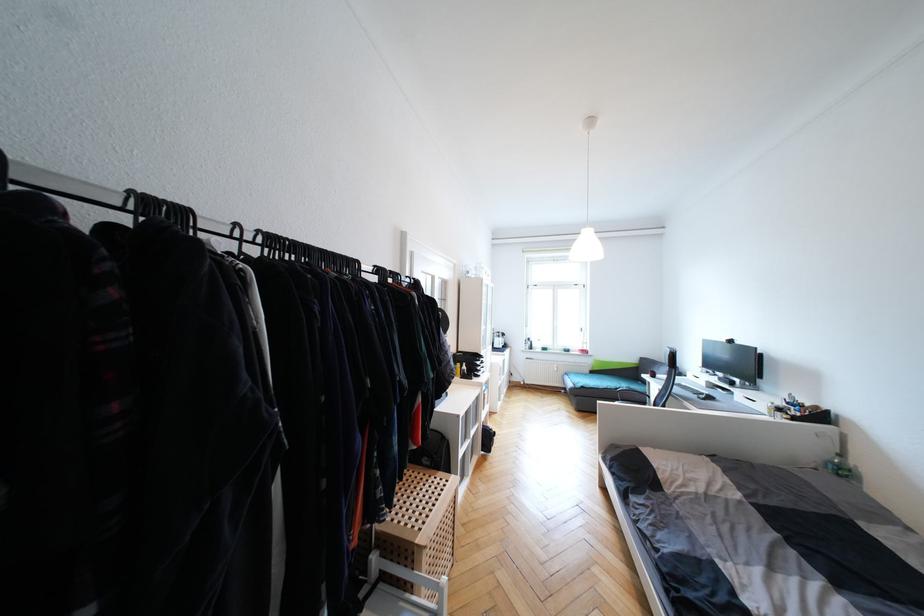
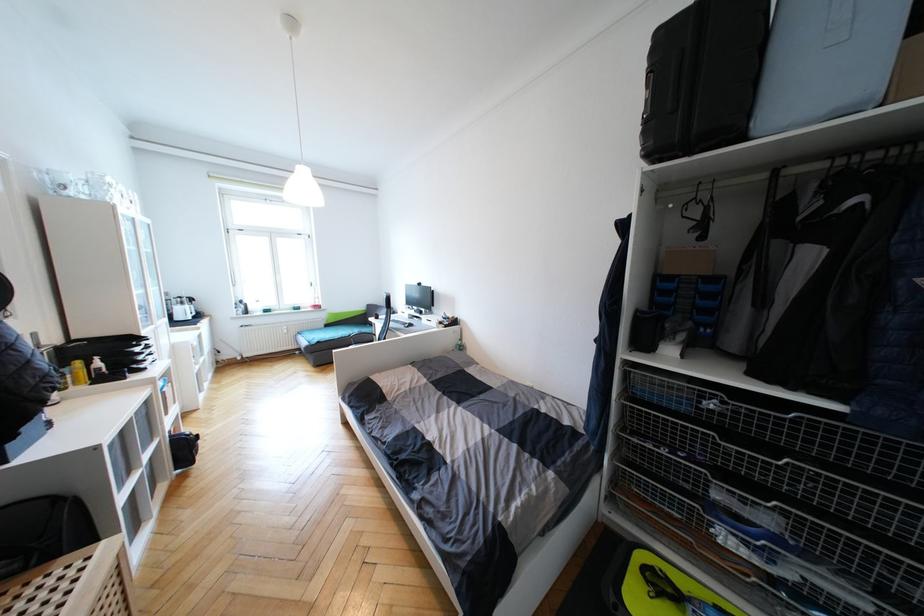
Locate, in the second image, the point that corresponds to point (502, 338) in the first image.

(186, 305)